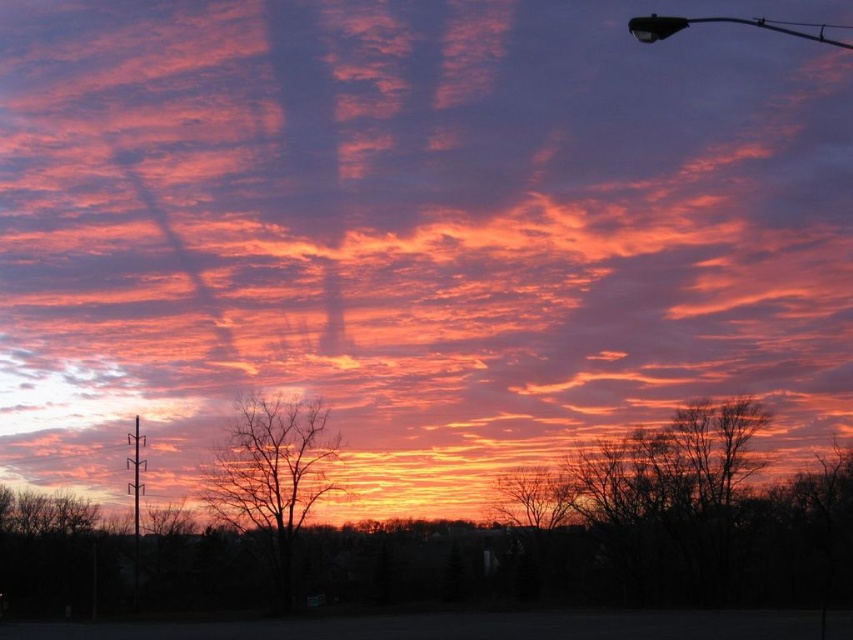
Does metallic pole at upper right have a larger size compared to metallic gray pole at left?

Yes.

Does metallic pole at upper right have a lesser height compared to metallic gray pole at left?

In fact, metallic pole at upper right may be taller than metallic gray pole at left.

Is point (682, 17) less distant than point (134, 506)?

No.

At what (x,y) coordinates should I click in order to perform the action: click on metallic pole at upper right. Please return your answer as a coordinate pair (x, y). This screenshot has height=640, width=853. Looking at the image, I should click on (722, 20).

Which of these two, silhouette bare tree at center or metallic gray pole at left, stands taller?

silhouette bare tree at center

Can you confirm if silhouette bare tree at center is bigger than metallic gray pole at left?

Actually, silhouette bare tree at center might be smaller than metallic gray pole at left.

At what (x,y) coordinates should I click in order to perform the action: click on silhouette bare tree at center. Please return your answer as a coordinate pair (x, y). Looking at the image, I should click on (271, 476).

Does silhouette bare tree at center have a lesser height compared to metallic pole at upper right?

Correct, silhouette bare tree at center is not as tall as metallic pole at upper right.

Find the location of a particular element. This screenshot has width=853, height=640. silhouette bare tree at center is located at coordinates (271, 476).

Which is in front, point (270, 445) or point (769, 24)?

Point (270, 445) is in front.

At what (x,y) coordinates should I click in order to perform the action: click on silhouette bare tree at center. Please return your answer as a coordinate pair (x, y). The width and height of the screenshot is (853, 640). Looking at the image, I should click on (271, 476).